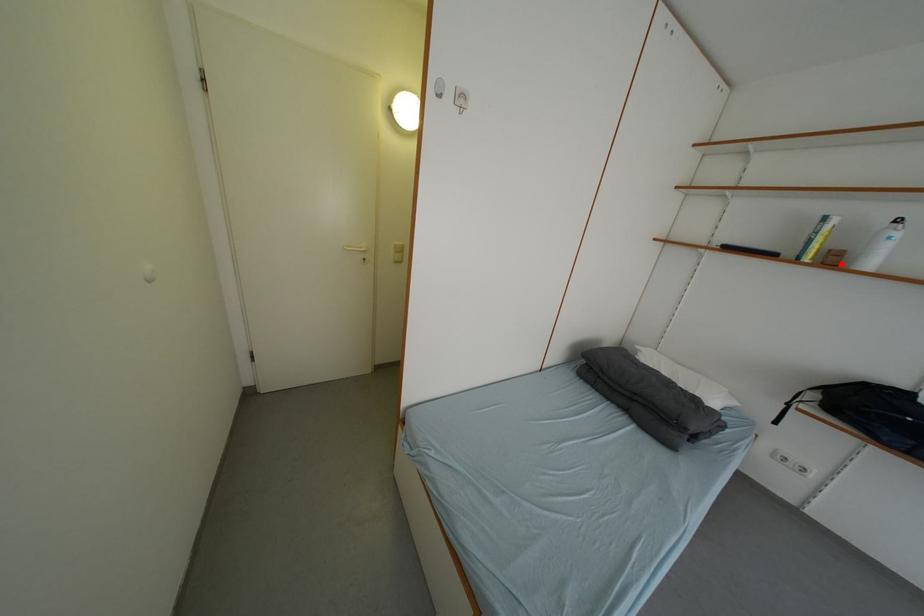
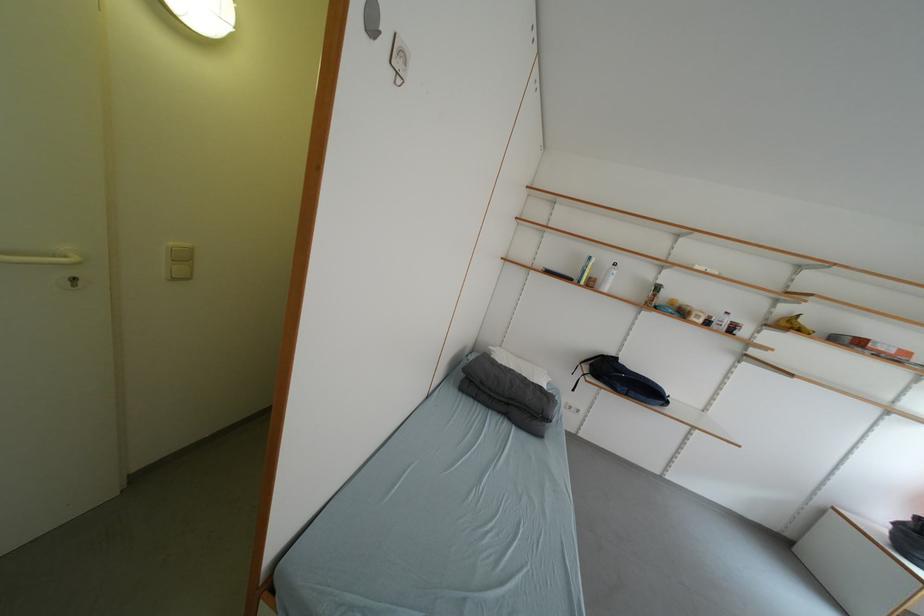
Find the pixel in the second image that matches the highlighted location in the first image.

(600, 286)